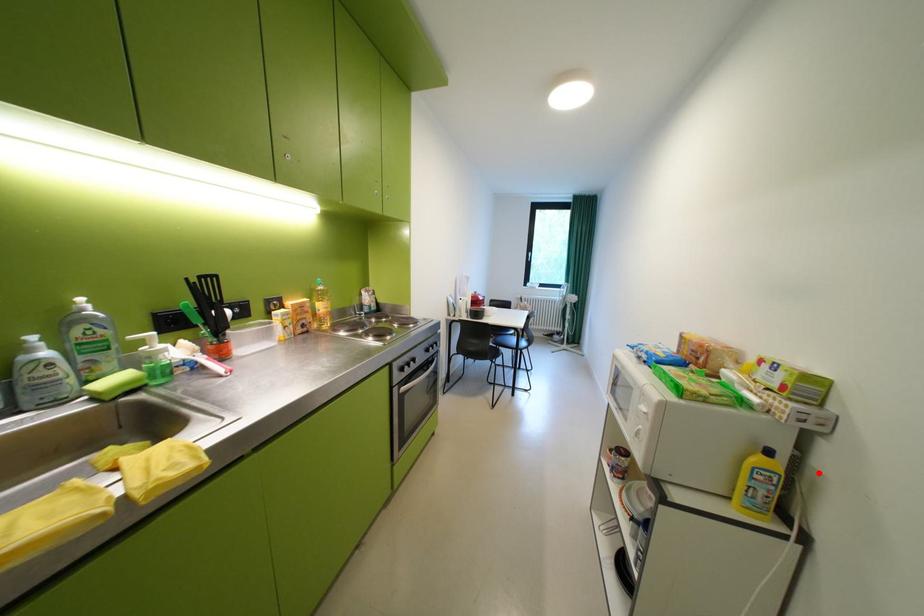
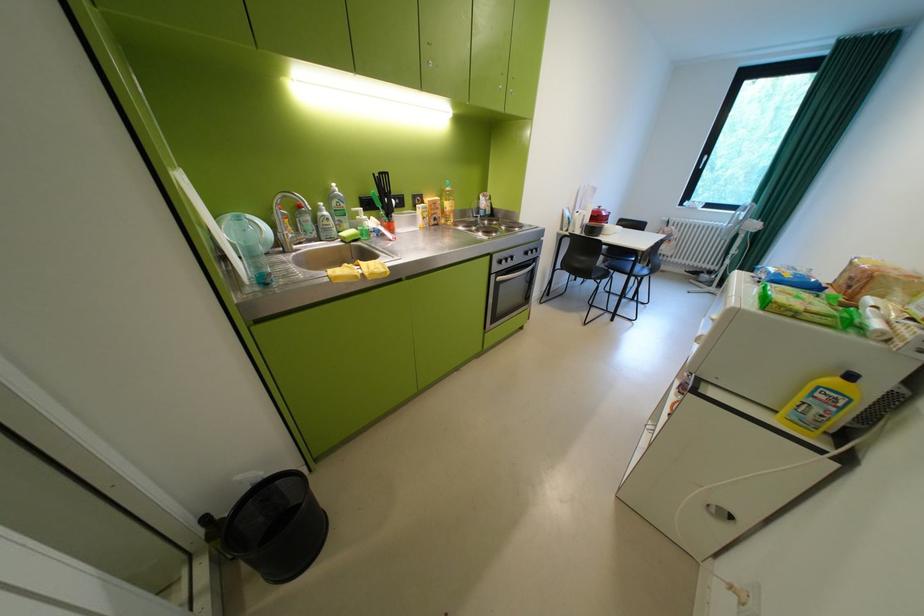
Where in the second image is the point corresponding to the highlighted location from the first image?

(918, 411)